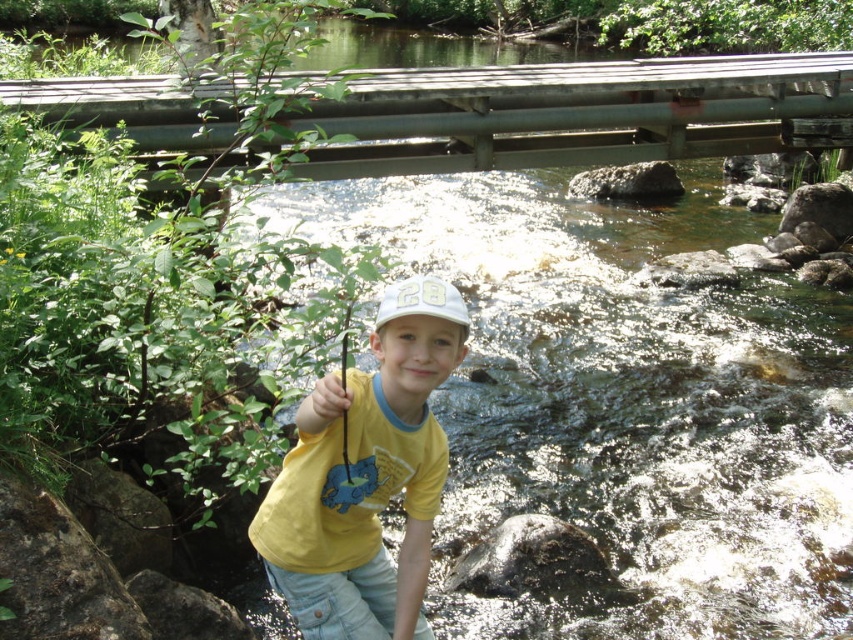
You are a photographer trying to capture the wooden bridge at upper center without the yellow cotton shirt at center blocking the view. Is the bridge visible above the shirt?

The wooden bridge at upper center is positioned over the yellow cotton shirt at center, so yes, the bridge is visible above the shirt and won not be blocked.